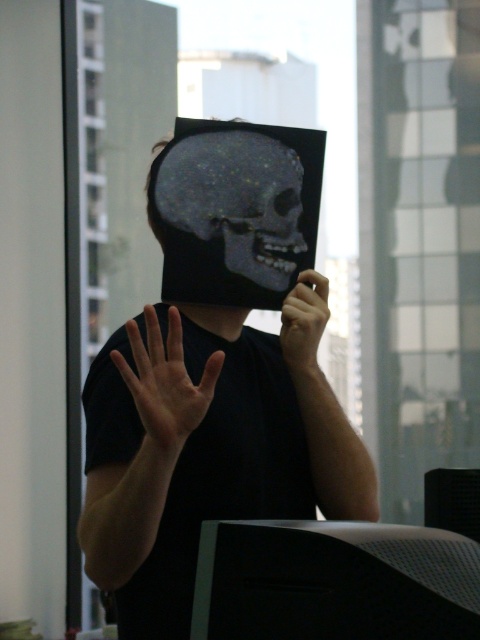
You are an architect designing a new building and need to place two points on a blueprint. You have two coordinates, point (118,369) and point (176,182). According to the image, which point is closer to the camera?

Point (118,369) is closer to the camera than point (176,182).

You are a delivery robot that needs to place a package between the matte black monitor at center and the smooth skin hand at center. The package is 40 centimeters long. Can you fit the package in the space between them?

The distance between the matte black monitor at center and the smooth skin hand at center is 37.02 centimeters. Since the package is 40 centimeters long, it is longer than the available space. Therefore, the package cannot be placed between them.

You are a character in a video game and need to move from your current position to the window to escape. There are two checkpoints marked as point 1 at point (469,618) and point 2 at point (133,348). Which checkpoint should you reach first to ensure you can safely reach the window?

Point 1 at point (469,618) is in front of point 2 at point (133,348), so you should reach point 1 first to ensure you can safely reach the window.